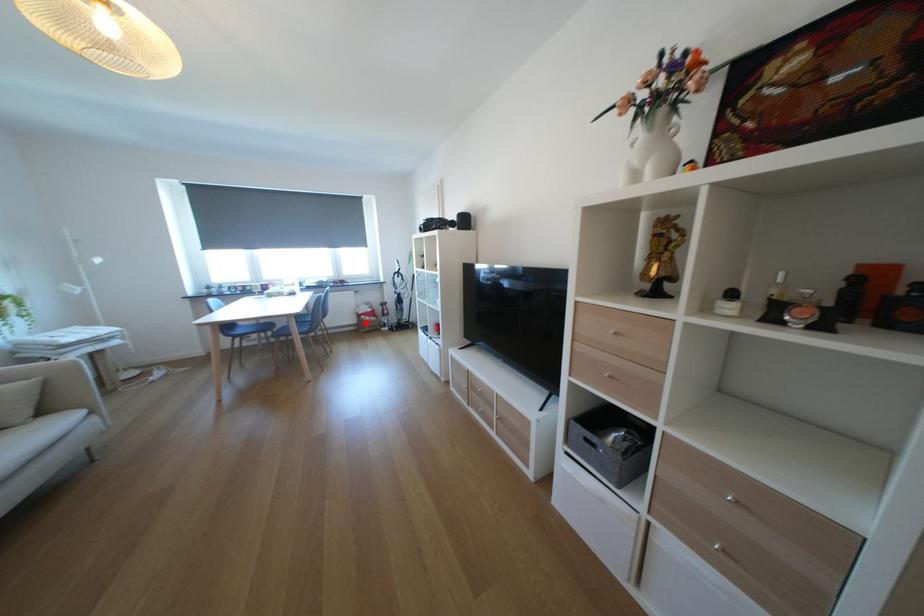
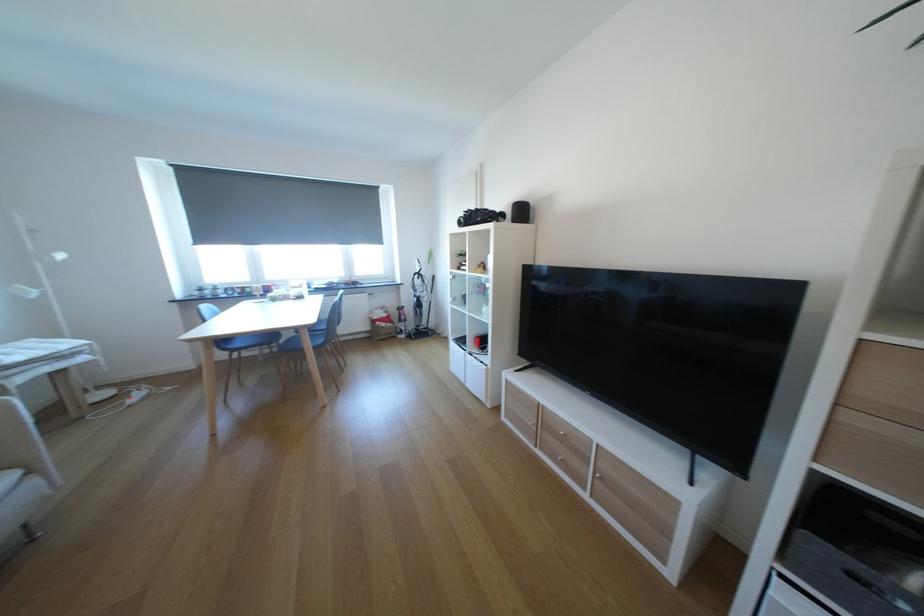
Question: I am providing you with two images of the same scene from different viewpoints. Given a red point in image1, look at the same physical point in image2. Is it:

Choices:
 (A) Closer to the viewpoint
 (B) Farther from the viewpoint

Answer: (A)